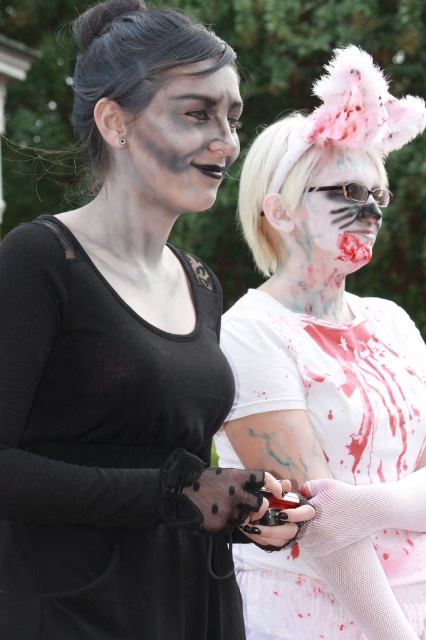
You are a costume designer trying to decide whether to place a decorative item on the white mesh glove at right or the matte black face paint at center. Which object has more space available for the item?

The white mesh glove at right might have more space available for the decorative item since it is wider than the matte black face paint at center.

You are a photographer setting up for a costume photoshoot. You need to position the white mesh glove at right and the matte black face paint at center so that the glove appears to the left of the face paint in the final photo. Based on their current positions, is this possible without moving either object?

The white mesh glove at right is currently to the right of the matte black face paint at center. To have the glove appear to the left of the face paint in the photo without moving them, you would need to invert the camera perspective, such as using a mirror or lens distortion, since their physical positions cannot be altered.

You are a photographer setting up for a photoshoot and need to ensure that both the matte black dress at center and the matte black face paint at center are visible in the frame. Given that the dress is wider, which object should you adjust your camera angle to prioritize capturing first?

The matte black dress at center has a larger width than the matte black face paint at center, so you should prioritize adjusting your camera angle to capture the wider matte black dress at center first to ensure it fits within the frame.